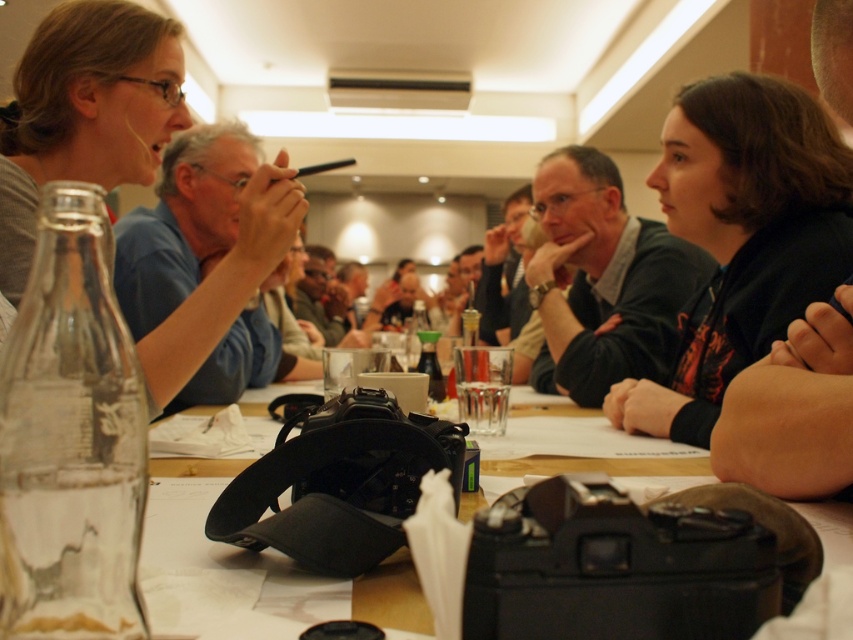
You are a participant in the meeting and need to grab a water bottle. Which bottle is closer to your left side? The clear glass bottle at lower left or the translucent glass bottle at center?

The clear glass bottle at lower left is to the left of the translucent glass bottle at center, so the clear glass bottle at lower left is closer to your left side.

You are a photographer who needs to take a photo of the group. The black plastic camera at center is currently below the translucent glass bottle at center. Can you move the camera to the side to get a clear shot without moving the bottle?

The black plastic camera at center is below the translucent glass bottle at center, so you can move the camera to the side to get a clear shot without moving the bottle.